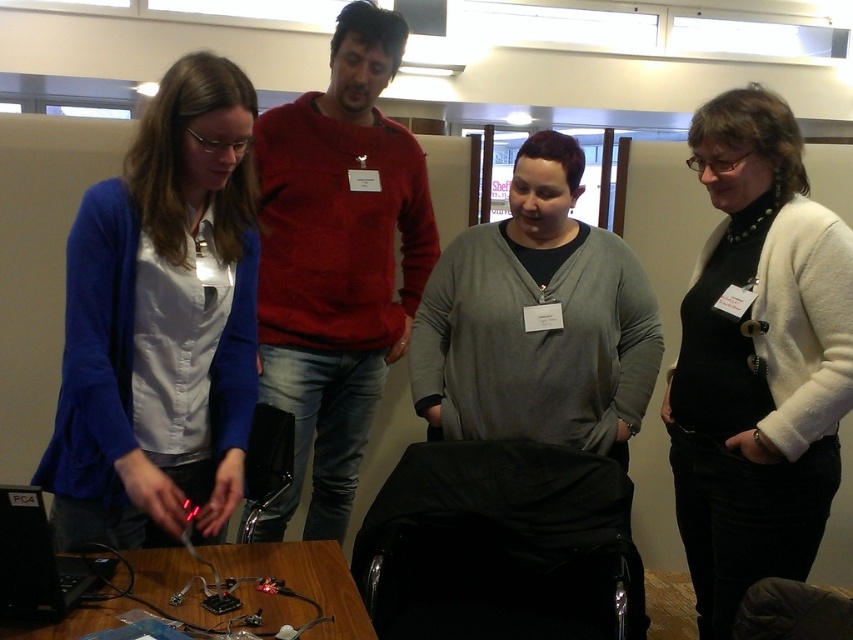
You are standing in the conference room and need to locate the person wearing the white wool sweater at upper right. Which direction should you look relative to the red sweater at center?

The white wool sweater at upper right is located to the right of the red sweater at center, so you should look to the right side of the red sweater at center to find the white wool sweater at upper right.

Consider the image. You are a photographer standing at the entrance of the room. You want to take a photo of both the white wool sweater at upper right and the gray matte sweater at center. The minimum distance between the two sweaters that allows both to be in frame without cropping is 12 inches. Can you capture both in a single shot?

The white wool sweater at upper right is 13.52 inches from the gray matte sweater at center. Since the minimum required distance is 12 inches, the photographer can capture both in a single shot as the actual distance exceeds the minimum requirement.